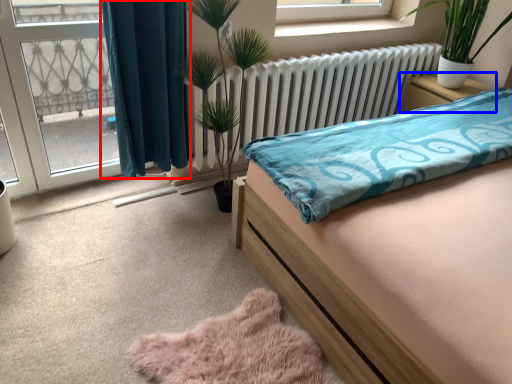
Question: Which of the following is the farthest to the observer, curtain (highlighted by a red box) or nightstand (highlighted by a blue box)?

Choices:
 (A) curtain
 (B) nightstand

Answer: (B)